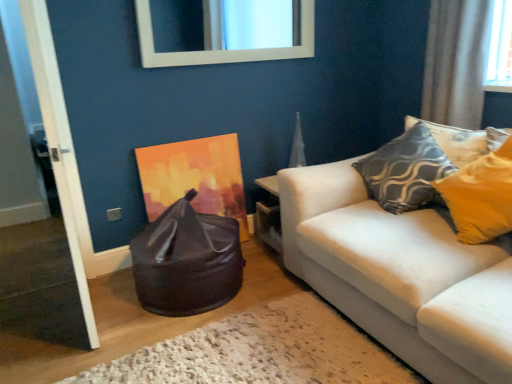
Where is `white glossy mirror at upper center`? Image resolution: width=512 pixels, height=384 pixels. white glossy mirror at upper center is located at coordinates (221, 50).

Can you confirm if glossy black bean bag at lower left is smaller than white glossy mirror at upper center?

No, glossy black bean bag at lower left is not smaller than white glossy mirror at upper center.

Would you say white glossy mirror at upper center is part of glossy black bean bag at lower left's contents?

No, white glossy mirror at upper center is located outside of glossy black bean bag at lower left.

Consider the image. Considering the relative sizes of glossy black bean bag at lower left and white glossy mirror at upper center in the image provided, is glossy black bean bag at lower left wider than white glossy mirror at upper center?

Indeed, glossy black bean bag at lower left has a greater width compared to white glossy mirror at upper center.

Consider the image. How different are the orientations of glossy black bean bag at lower left and white glossy mirror at upper center in degrees?

They differ by 0.00312 degrees in their facing directions.

Considering the sizes of objects glossy black bean bag at lower left and white sheer curtain at upper right in the image provided, who is shorter, glossy black bean bag at lower left or white sheer curtain at upper right?

With less height is glossy black bean bag at lower left.

Between point (208, 262) and point (468, 66), which one is positioned in front?

Positioned in front is point (208, 262).

How different are the orientations of glossy black bean bag at lower left and white sheer curtain at upper right in degrees?

90.2 degrees separate the facing orientations of glossy black bean bag at lower left and white sheer curtain at upper right.

Is glossy black bean bag at lower left to the right of white sheer curtain at upper right from the viewer's perspective?

No.

In order to click on bean bag chair located on the left of white glossy mirror at upper center in this screenshot , I will do `click(187, 261)`.

How much distance is there between white glossy mirror at upper center and glossy black bean bag at lower left?

white glossy mirror at upper center and glossy black bean bag at lower left are 1.18 meters apart.

Who is shorter, white glossy mirror at upper center or glossy black bean bag at lower left?

white glossy mirror at upper center is shorter.

In the image, is white glossy mirror at upper center positioned in front of or behind glossy black bean bag at lower left?

white glossy mirror at upper center is behind glossy black bean bag at lower left.

Who is more distant, textured gray pillow at upper right or white wooden door at left?

Positioned behind is textured gray pillow at upper right.

Is textured gray pillow at upper right inside or outside of white wooden door at left?

textured gray pillow at upper right lies outside white wooden door at left.

Is white wooden door at left at the back of textured gray pillow at upper right?

No, textured gray pillow at upper right is not facing away from white wooden door at left.

Is textured gray pillow at upper right thinner than white wooden door at left?

No, textured gray pillow at upper right is not thinner than white wooden door at left.

Which of these two, white sheer curtain at upper right or textured gray pillow at upper right, stands taller?

Standing taller between the two is white sheer curtain at upper right.

Which object is further away from the camera taking this photo, white sheer curtain at upper right or textured gray pillow at upper right?

white sheer curtain at upper right is further away from the camera.

Is white sheer curtain at upper right at the right side of textured gray pillow at upper right?

Correct, you'll find white sheer curtain at upper right to the right of textured gray pillow at upper right.

From a real-world perspective, who is located lower, white glossy mirror at upper center or white sheer curtain at upper right?

white sheer curtain at upper right.

Is white glossy mirror at upper center next to white sheer curtain at upper right and touching it?

No, white glossy mirror at upper center is not touching white sheer curtain at upper right.

Consider the image. Is white glossy mirror at upper center in front of or behind white sheer curtain at upper right in the image?

white glossy mirror at upper center is behind white sheer curtain at upper right.

From the image's perspective, would you say white glossy mirror at upper center is positioned over white sheer curtain at upper right?

Indeed, from the image's perspective, white glossy mirror at upper center is shown above white sheer curtain at upper right.

Which is farther from the camera, (196, 62) or (32, 56)?

The point (196, 62) is behind.

Is white wooden door at left at the back of white glossy mirror at upper center?

white glossy mirror at upper center does not have its back to white wooden door at left.

Locate an element on the screen. Image resolution: width=512 pixels, height=384 pixels. door that is below the white glossy mirror at upper center (from the image's perspective) is located at coordinates (36, 202).

Locate an element on the screen. bean bag chair on the left of white glossy mirror at upper center is located at coordinates (187, 261).

Find the location of a particular element. curtain above the glossy black bean bag at lower left (from a real-world perspective) is located at coordinates (456, 62).

When comparing their distances from white sheer curtain at upper right, does white wooden door at left or glossy black bean bag at lower left seem closer?

The object closer to white sheer curtain at upper right is glossy black bean bag at lower left.

Based on their spatial positions, is white glossy mirror at upper center or textured gray pillow at upper right closer to white wooden door at left?

Among the two, white glossy mirror at upper center is located nearer to white wooden door at left.

Consider the image. Considering their positions, is white wooden door at left positioned closer to white glossy mirror at upper center than white sheer curtain at upper right?

Among the two, white sheer curtain at upper right is located nearer to white glossy mirror at upper center.

Which object lies nearer to the anchor point white wooden door at left, white sheer curtain at upper right or white glossy mirror at upper center?

white glossy mirror at upper center is closer to white wooden door at left.

Based on their spatial positions, is white wooden door at left or white glossy mirror at upper center further from glossy black bean bag at lower left?

The object further to glossy black bean bag at lower left is white glossy mirror at upper center.

Which object lies further to the anchor point white sheer curtain at upper right, white glossy mirror at upper center or glossy black bean bag at lower left?

Among the two, glossy black bean bag at lower left is located further to white sheer curtain at upper right.

From the image, which object appears to be farther from white sheer curtain at upper right, white glossy mirror at upper center or textured gray pillow at upper right?

white glossy mirror at upper center is positioned further to the anchor white sheer curtain at upper right.

When comparing their distances from glossy black bean bag at lower left, does white glossy mirror at upper center or white wooden door at left seem closer?

Based on the image, white wooden door at left appears to be nearer to glossy black bean bag at lower left.

The height and width of the screenshot is (384, 512). I want to click on pillow located between white wooden door at left and white sheer curtain at upper right in the left-right direction, so click(463, 140).

The height and width of the screenshot is (384, 512). I want to click on mirror between glossy black bean bag at lower left and textured gray pillow at upper right, so click(221, 50).

Locate an element on the screen. mirror between white wooden door at left and textured gray pillow at upper right in the horizontal direction is located at coordinates (221, 50).

Identify the location of mirror between glossy black bean bag at lower left and white sheer curtain at upper right. (221, 50).